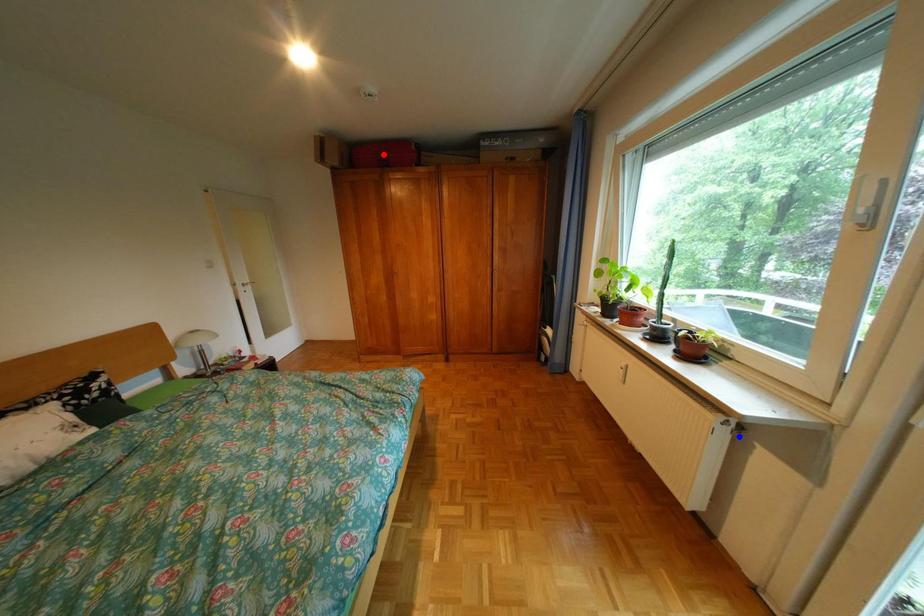
Question: Which of the two points in the image is closer to the camera?

Choices:
 (A) Blue point is closer.
 (B) Red point is closer.

Answer: (A)